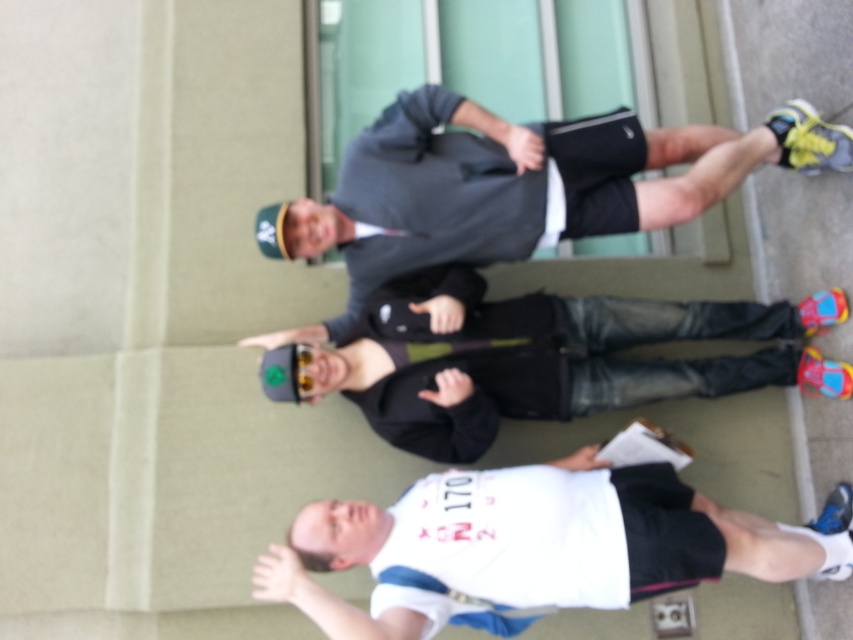
Which is behind, point (525, 337) or point (346, 513)?

Positioned behind is point (525, 337).

What do you see at coordinates (527, 356) in the screenshot?
I see `black leather jacket at center` at bounding box center [527, 356].

At what (x,y) coordinates should I click in order to perform the action: click on black leather jacket at center. Please return your answer as a coordinate pair (x, y). Image resolution: width=853 pixels, height=640 pixels. Looking at the image, I should click on (527, 356).

Can you confirm if dark gray jacket at upper center is bigger than white matte shirt at lower center?

Incorrect, dark gray jacket at upper center is not larger than white matte shirt at lower center.

Who is more distant from viewer, (392, 122) or (657, 566)?

Positioned behind is point (392, 122).

Locate an element on the screen. This screenshot has height=640, width=853. dark gray jacket at upper center is located at coordinates (421, 196).

Who is shorter, dark gray jacket at upper center or black leather jacket at center?

Standing shorter between the two is black leather jacket at center.

Measure the distance between point (331, 225) and camera.

A distance of 3.39 meters exists between point (331, 225) and camera.

Locate an element on the screen. dark gray jacket at upper center is located at coordinates (421, 196).